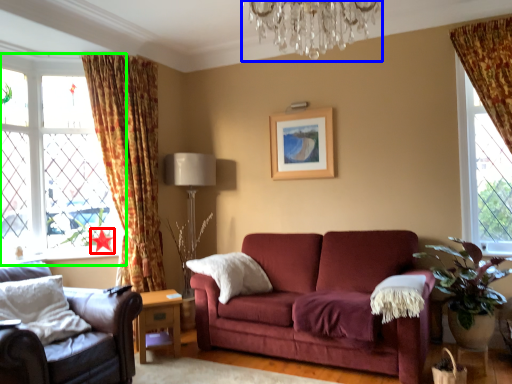
Question: Considering the real-world distances, which object is closest to star (highlighted by a red box)? light fixture (highlighted by a blue box) or window (highlighted by a green box).

Choices:
 (A) light fixture
 (B) window

Answer: (B)